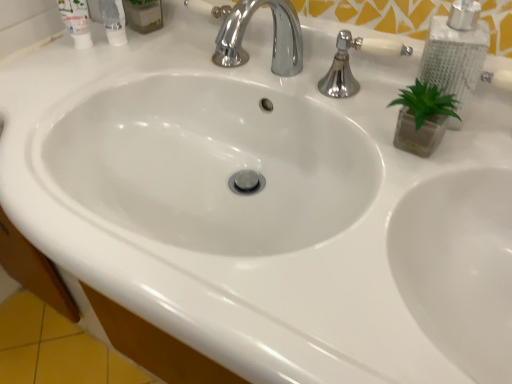
Question: Would you say silver metallic soap dispenser at upper right is outside white plastic mouthwash at upper left, the first mouthwash viewed from the right?

Choices:
 (A) yes
 (B) no

Answer: (A)

Question: Is silver metallic soap dispenser at upper right positioned behind white plastic mouthwash at upper left, the second mouthwash positioned from the left?

Choices:
 (A) no
 (B) yes

Answer: (A)

Question: Does silver metallic soap dispenser at upper right have a larger size compared to white plastic mouthwash at upper left, the second mouthwash positioned from the left?

Choices:
 (A) yes
 (B) no

Answer: (A)

Question: Could you tell me if silver metallic soap dispenser at upper right is turned towards white plastic mouthwash at upper left, the first mouthwash viewed from the right?

Choices:
 (A) no
 (B) yes

Answer: (A)

Question: Is white plastic mouthwash at upper left, the second mouthwash positioned from the left, at the back of silver metallic soap dispenser at upper right?

Choices:
 (A) yes
 (B) no

Answer: (B)

Question: Would you say white glossy tube at upper left, which appears as the 2th mouthwash when viewed from the right, is to the left or to the right of white plastic mouthwash at upper left, the second mouthwash positioned from the left, in the picture?

Choices:
 (A) right
 (B) left

Answer: (B)

Question: From a real-world perspective, relative to white plastic mouthwash at upper left, the first mouthwash viewed from the right, is white glossy tube at upper left, the 1th mouthwash from the left, vertically above or below?

Choices:
 (A) above
 (B) below

Answer: (B)

Question: Is white glossy tube at upper left, the 1th mouthwash from the left, wider or thinner than white plastic mouthwash at upper left, the first mouthwash viewed from the right?

Choices:
 (A) thin
 (B) wide

Answer: (B)

Question: Is white glossy tube at upper left, the 1th mouthwash from the left, taller or shorter than white plastic mouthwash at upper left, the first mouthwash viewed from the right?

Choices:
 (A) tall
 (B) short

Answer: (B)

Question: Is white plastic mouthwash at upper left, the first mouthwash viewed from the right, to the left or to the right of white glossy tube at upper left, which appears as the 2th mouthwash when viewed from the right, in the image?

Choices:
 (A) left
 (B) right

Answer: (B)

Question: Relative to white glossy tube at upper left, which appears as the 2th mouthwash when viewed from the right, is white plastic mouthwash at upper left, the second mouthwash positioned from the left, in front or behind?

Choices:
 (A) front
 (B) behind

Answer: (B)

Question: Is white plastic mouthwash at upper left, the second mouthwash positioned from the left, taller or shorter than white glossy tube at upper left, the 1th mouthwash from the left?

Choices:
 (A) tall
 (B) short

Answer: (A)

Question: Looking at the image, does white plastic mouthwash at upper left, the first mouthwash viewed from the right, seem bigger or smaller compared to white glossy tube at upper left, the 1th mouthwash from the left?

Choices:
 (A) big
 (B) small

Answer: (B)

Question: From a real-world perspective, is silver metallic soap dispenser at upper right positioned above or below white glossy tube at upper left, the 1th mouthwash from the left?

Choices:
 (A) above
 (B) below

Answer: (A)

Question: In terms of height, does silver metallic soap dispenser at upper right look taller or shorter compared to white glossy tube at upper left, the 1th mouthwash from the left?

Choices:
 (A) short
 (B) tall

Answer: (B)